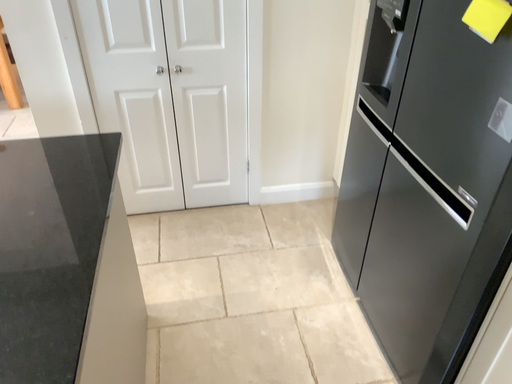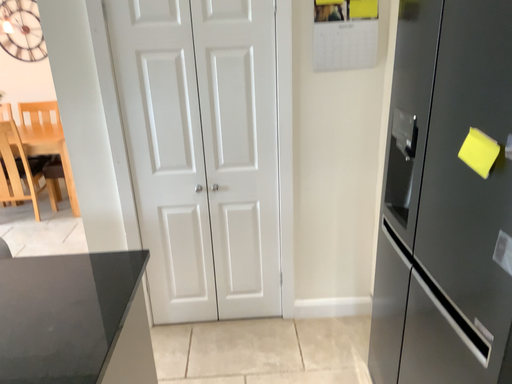
Question: How did the camera likely rotate when shooting the video?

Choices:
 (A) rotated left
 (B) rotated right

Answer: (A)